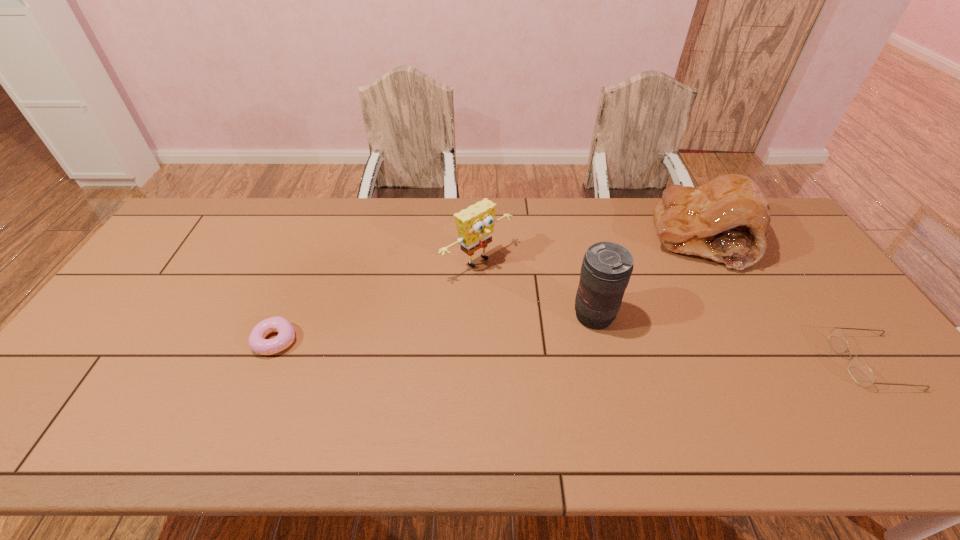
In order to click on the shortest object in this screenshot , I will do `click(286, 335)`.

I want to click on doughnut, so click(286, 335).

Image resolution: width=960 pixels, height=540 pixels. I want to click on spectacles, so click(860, 372).

Find the location of a particular element. This screenshot has width=960, height=540. bread is located at coordinates (727, 219).

You are a GUI agent. You are given a task and a screenshot of the screen. Output one action in this format:
    pyautogui.click(x=<x>, y=<y>)
    Task: Click on the sponge
    
    Given the screenshot: What is the action you would take?
    pyautogui.click(x=475, y=225)

At what (x,y) coordinates should I click in order to perform the action: click on the third object from left to right. Please return your answer as a coordinate pair (x, y). The image size is (960, 540). Looking at the image, I should click on (606, 269).

Find the location of a particular element. The image size is (960, 540). vacant region located 0.300m on the right of the doughnut is located at coordinates (411, 341).

Find the location of a particular element. This screenshot has height=540, width=960. vacant space located on the front-facing side of the spectacles is located at coordinates (683, 362).

The height and width of the screenshot is (540, 960). I want to click on free space located on the front-facing side of the spectacles, so click(x=733, y=362).

Image resolution: width=960 pixels, height=540 pixels. I want to click on free point located 0.110m on the front-facing side of the spectacles, so click(797, 362).